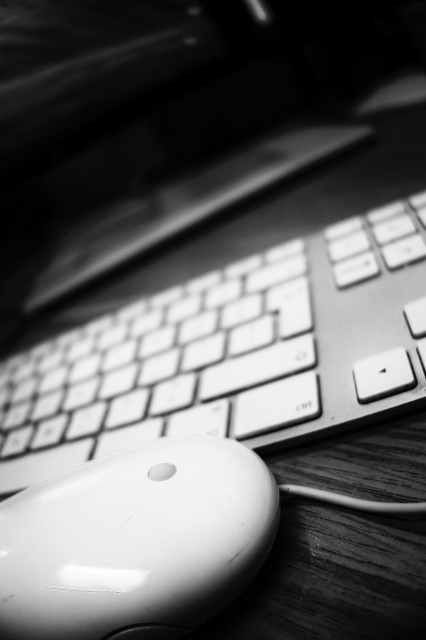
Question: Can you confirm if white plastic keyboard at center is bigger than white glossy mouse at lower left?

Choices:
 (A) yes
 (B) no

Answer: (A)

Question: Which point appears farthest from the camera in this image?

Choices:
 (A) (241, 289)
 (B) (49, 504)

Answer: (A)

Question: Is white plastic keyboard at center behind white glossy mouse at lower left?

Choices:
 (A) no
 (B) yes

Answer: (B)

Question: Which of the following is the closest to the observer?

Choices:
 (A) (13, 483)
 (B) (42, 502)

Answer: (B)

Question: Is white plastic keyboard at center to the left of white glossy mouse at lower left from the viewer's perspective?

Choices:
 (A) yes
 (B) no

Answer: (A)